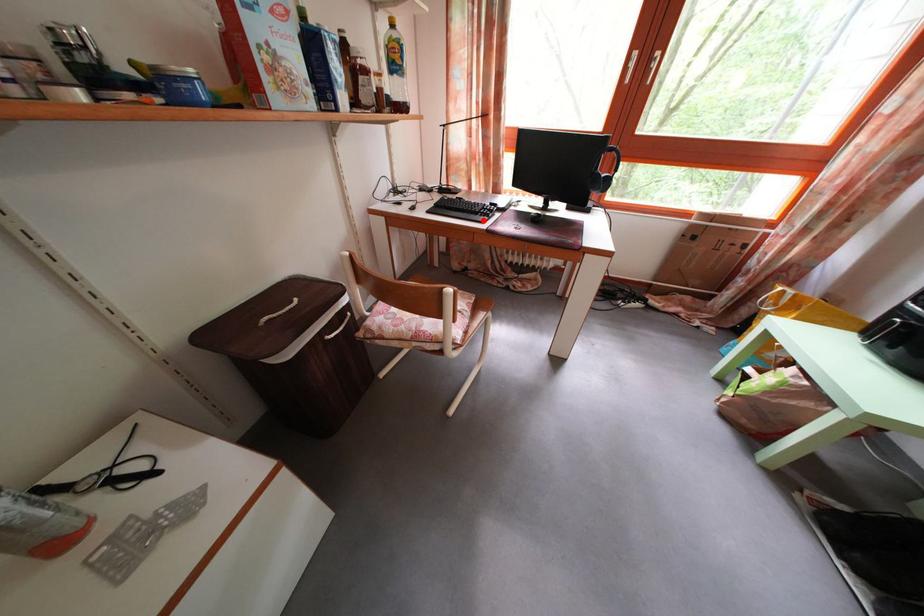
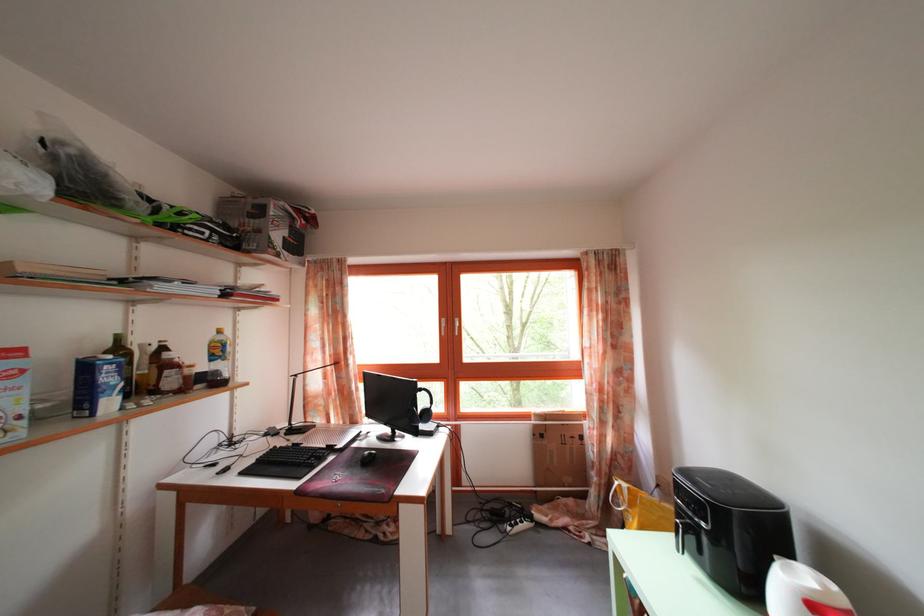
The point at the highlighted location is marked in the first image. Where is the corresponding point in the second image?

(307, 472)